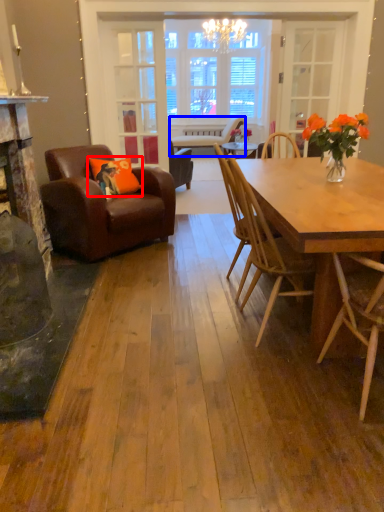
Question: Among these objects, which one is farthest to the camera, pillow (highlighted by a red box) or chair (highlighted by a blue box)?

Choices:
 (A) pillow
 (B) chair

Answer: (B)